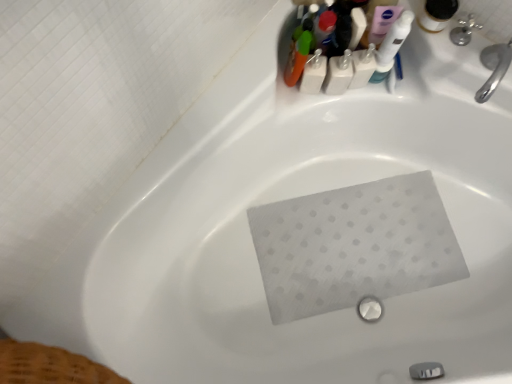
Locate an element on the screen. free space in front of brushed metal faucet at upper right is located at coordinates (466, 61).